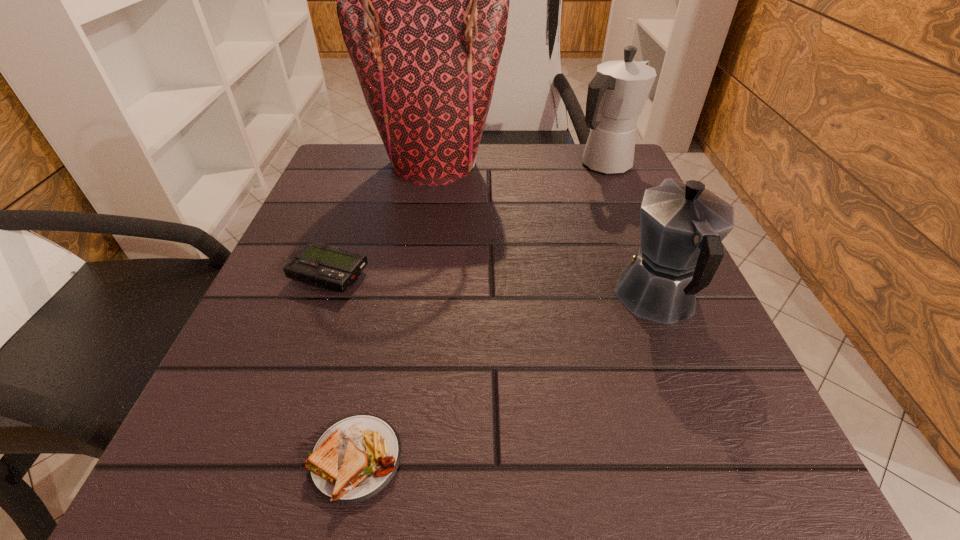
You are a GUI agent. You are given a task and a screenshot of the screen. Output one action in this format:
    pyautogui.click(x=<x>, y=<y>)
    Task: Click on the sandwich at the left edge
    
    Given the screenshot: What is the action you would take?
    pyautogui.click(x=355, y=458)

This screenshot has height=540, width=960. In order to click on object at the far left corner in this screenshot , I will do (x=422, y=0).

You are a GUI agent. You are given a task and a screenshot of the screen. Output one action in this format:
    pyautogui.click(x=<x>, y=<y>)
    Task: Click on the object present at the near left corner
    The width and height of the screenshot is (960, 540).
    Given the screenshot: What is the action you would take?
    pyautogui.click(x=355, y=458)

The width and height of the screenshot is (960, 540). Identify the location of object positioned at the far right corner. (616, 95).

You are a GUI agent. You are given a task and a screenshot of the screen. Output one action in this format:
    pyautogui.click(x=<x>, y=<y>)
    Task: Click on the free region at the far edge of the desktop
    The image size is (960, 540).
    Given the screenshot: What is the action you would take?
    pyautogui.click(x=482, y=144)

I want to click on free space at the near edge of the desktop, so tap(627, 440).

The height and width of the screenshot is (540, 960). In the image, there is a desktop. In order to click on vacant space at the left edge in this screenshot , I will do `click(322, 206)`.

In order to click on free region at the right edge of the desktop in this screenshot , I will do `click(732, 362)`.

You are a GUI agent. You are given a task and a screenshot of the screen. Output one action in this format:
    pyautogui.click(x=<x>, y=<y>)
    Task: Click on the free space at the far left corner of the desktop
    
    Given the screenshot: What is the action you would take?
    pyautogui.click(x=381, y=175)

Identify the location of vacant space at the far right corner of the desktop. (636, 186).